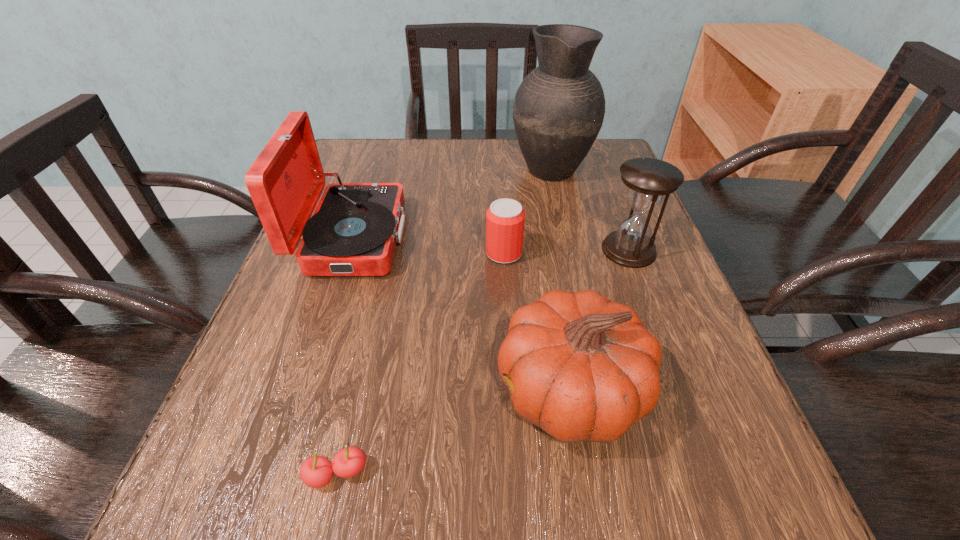
Locate an element on the screen. free space located 0.200m on the face of the pumpkin is located at coordinates (363, 390).

Identify the location of free space located 0.280m on the face of the pumpkin. This screenshot has height=540, width=960. point(309,390).

This screenshot has width=960, height=540. Find the location of `vacant position located 0.270m on the front of the second shortest object`. vacant position located 0.270m on the front of the second shortest object is located at coordinates (512, 387).

This screenshot has width=960, height=540. In order to click on free space located 0.400m on the right of the shortest object in this screenshot , I will do `click(676, 474)`.

This screenshot has height=540, width=960. In order to click on object located at the far edge in this screenshot , I will do `click(558, 111)`.

Image resolution: width=960 pixels, height=540 pixels. I want to click on object that is at the near edge, so click(x=317, y=471).

This screenshot has width=960, height=540. Find the location of `phonograph_record that is at the left edge`. phonograph_record that is at the left edge is located at coordinates (354, 229).

Locate an element on the screen. Image resolution: width=960 pixels, height=540 pixels. cherry present at the left edge is located at coordinates (317, 471).

This screenshot has width=960, height=540. Find the location of `pitcher located in the right edge section of the desktop`. pitcher located in the right edge section of the desktop is located at coordinates (558, 111).

Where is `hourglass that is at the right edge`? The image size is (960, 540). hourglass that is at the right edge is located at coordinates (648, 180).